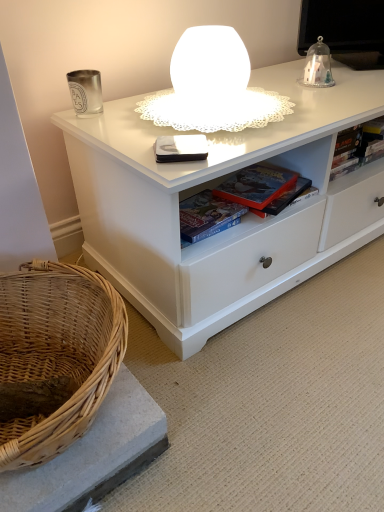
Measure the distance between hardcover book at upper right, acting as the first book starting from the right, and camera.

They are 3.57 feet apart.

I want to click on hardcover book at upper right, the first book positioned from the back, so click(x=358, y=147).

Describe the element at coordinates (212, 87) in the screenshot. Image resolution: width=384 pixels, height=512 pixels. I see `white frosted glass table lamp at upper center` at that location.

I want to click on white frosted glass table lamp at upper center, so click(x=212, y=87).

The image size is (384, 512). Describe the element at coordinates (226, 211) in the screenshot. I see `matte plastic book at center, acting as the 3th book starting from the left` at that location.

What is the approximate height of matte plastic book at center, which is the third book from front to back?

The height of matte plastic book at center, which is the third book from front to back, is 1.68 inches.

Measure the distance between point (203, 194) and camera.

The depth of point (203, 194) is 3.40 feet.

Locate an element on the screen. The height and width of the screenshot is (512, 384). hardcover book at upper right, which is the fourth book from left to right is located at coordinates (358, 147).

Which point is more forward, (199, 145) or (224, 225)?

Point (199, 145)

From a real-world perspective, which object rests below the other?

matte board game at center, acting as the 2th book starting from the left, from a real-world perspective.

Does glossy black book at center, the 4th book viewed from the right, appear on the left side of matte board game at center, arranged as the 2th book when viewed from the front?

Indeed, glossy black book at center, the 4th book viewed from the right, is positioned on the left side of matte board game at center, arranged as the 2th book when viewed from the front.

Does white frosted glass table lamp at upper center touch hardcover book at upper right, acting as the first book starting from the right?

No, white frosted glass table lamp at upper center is not next to hardcover book at upper right, acting as the first book starting from the right.

Can you confirm if white frosted glass table lamp at upper center is bigger than hardcover book at upper right, which is the fourth book from left to right?

Correct, white frosted glass table lamp at upper center is larger in size than hardcover book at upper right, which is the fourth book from left to right.

From the image's perspective, between white frosted glass table lamp at upper center and hardcover book at upper right, acting as the first book starting from the right, who is located below?

hardcover book at upper right, acting as the first book starting from the right.

In the scene shown: Can you tell me how much white frosted glass table lamp at upper center and hardcover book at upper right, acting as the first book starting from the right, differ in facing direction?

There is a 4.54-degree angle between the facing directions of white frosted glass table lamp at upper center and hardcover book at upper right, acting as the first book starting from the right.

Is the position of glossy black book at center, which is the first book in front-to-back order, less distant than that of white frosted glass table lamp at upper center?

No, it is behind white frosted glass table lamp at upper center.

Is point (191, 146) closer to viewer compared to point (196, 104)?

Yes, point (191, 146) is closer to viewer.

Could you tell me if glossy black book at center, which is the first book in front-to-back order, is turned towards white frosted glass table lamp at upper center?

No, glossy black book at center, which is the first book in front-to-back order, is not turned towards white frosted glass table lamp at upper center.

From the image's perspective, is glossy black book at center, the 1th book from the left, beneath white frosted glass table lamp at upper center?

Correct, glossy black book at center, the 1th book from the left, appears lower than white frosted glass table lamp at upper center in the image.

Consider the image. From the image's perspective, is white frosted glass table lamp at upper center above or below matte board game at center, which ranks as the 3th book in back-to-front order?

Clearly, from the image's perspective, white frosted glass table lamp at upper center is above matte board game at center, which ranks as the 3th book in back-to-front order.

Between white frosted glass table lamp at upper center and matte board game at center, which is counted as the third book, starting from the right, which one has more height?

white frosted glass table lamp at upper center is taller.

From a real-world perspective, is white frosted glass table lamp at upper center above or below matte board game at center, which ranks as the 3th book in back-to-front order?

Clearly, from a real-world perspective, white frosted glass table lamp at upper center is above matte board game at center, which ranks as the 3th book in back-to-front order.

Is hardcover book at upper right, acting as the first book starting from the right, positioned far away from matte plastic book at center, which is the third book from front to back?

hardcover book at upper right, acting as the first book starting from the right, is near matte plastic book at center, which is the third book from front to back, not far away.

Who is more distant, hardcover book at upper right, which is the fourth book from left to right, or matte plastic book at center, which is the third book from front to back?

hardcover book at upper right, which is the fourth book from left to right, is further from the camera.

From the image's perspective, does hardcover book at upper right, the first book positioned from the back, appear higher than matte plastic book at center, acting as the 3th book starting from the left?

Yes.

Looking at this image, which object is positioned more to the right, hardcover book at upper right, the first book positioned from the back, or matte plastic book at center, marked as the second book in a right-to-left arrangement?

hardcover book at upper right, the first book positioned from the back, is more to the right.

How different are the orientations of glossy black book at center, the 1th book from the left, and hardcover book at upper right, acting as the fourth book starting from the front, in degrees?

glossy black book at center, the 1th book from the left, and hardcover book at upper right, acting as the fourth book starting from the front, are facing 34.4 degrees away from each other.

Would you consider glossy black book at center, the 4th book viewed from the right, to be distant from hardcover book at upper right, acting as the first book starting from the right?

Actually, glossy black book at center, the 4th book viewed from the right, and hardcover book at upper right, acting as the first book starting from the right, are a little close together.

Based on the photo, between glossy black book at center, which is the first book in front-to-back order, and hardcover book at upper right, acting as the fourth book starting from the front, which one appears on the right side from the viewer's perspective?

hardcover book at upper right, acting as the fourth book starting from the front.

From the image's perspective, between glossy black book at center, the 4th book viewed from the right, and hardcover book at upper right, the first book positioned from the back, which one is located above?

hardcover book at upper right, the first book positioned from the back, appears higher in the image.

Considering the relative positions of matte plastic book at center, acting as the 3th book starting from the left, and white frosted glass table lamp at upper center in the image provided, is matte plastic book at center, acting as the 3th book starting from the left, to the left or to the right of white frosted glass table lamp at upper center?

matte plastic book at center, acting as the 3th book starting from the left, is positioned on white frosted glass table lamp at upper center's right side.

From the image's perspective, is matte plastic book at center, which is the third book from front to back, located beneath white frosted glass table lamp at upper center?

Indeed, from the image's perspective, matte plastic book at center, which is the third book from front to back, is shown beneath white frosted glass table lamp at upper center.

Is matte plastic book at center, which is the third book from front to back, facing towards white frosted glass table lamp at upper center?

No, matte plastic book at center, which is the third book from front to back, is not oriented towards white frosted glass table lamp at upper center.

Is there a large distance between matte plastic book at center, which is the third book from front to back, and white frosted glass table lamp at upper center?

No.

Locate an element on the screen. The height and width of the screenshot is (512, 384). book on the left of matte board game at center, acting as the 2th book starting from the left is located at coordinates (180, 148).

There is a hardcover book at upper right, the first book positioned from the back. At what (x,y) coordinates should I click in order to perform the action: click on table lamp above it (from a real-world perspective). Please return your answer as a coordinate pair (x, y). Looking at the image, I should click on (212, 87).

When comparing their distances from white frosted glass table lamp at upper center, does glossy black book at center, the 4th book viewed from the right, or matte plastic book at center, the 2th book positioned from the back, seem closer?

glossy black book at center, the 4th book viewed from the right.

Looking at the image, which one is located further to matte board game at center, arranged as the 2th book when viewed from the front, white frosted glass table lamp at upper center or hardcover book at upper right, acting as the first book starting from the right?

hardcover book at upper right, acting as the first book starting from the right, lies further to matte board game at center, arranged as the 2th book when viewed from the front, than the other object.

Looking at the image, which one is located further to matte board game at center, which is counted as the third book, starting from the right, glossy black book at center, the 1th book from the left, or matte plastic book at center, marked as the second book in a right-to-left arrangement?

glossy black book at center, the 1th book from the left, is further to matte board game at center, which is counted as the third book, starting from the right.

When comparing their distances from white frosted glass table lamp at upper center, does hardcover book at upper right, which is the fourth book from left to right, or matte board game at center, which is counted as the third book, starting from the right, seem further?

hardcover book at upper right, which is the fourth book from left to right.

Estimate the real-world distances between objects in this image. Which object is further from white frosted glass table lamp at upper center, matte board game at center, acting as the 2th book starting from the left, or hardcover book at upper right, acting as the fourth book starting from the front?

Among the two, hardcover book at upper right, acting as the fourth book starting from the front, is located further to white frosted glass table lamp at upper center.

Estimate the real-world distances between objects in this image. Which object is further from white frosted glass table lamp at upper center, glossy black book at center, the 4th book viewed from the right, or matte board game at center, which is counted as the third book, starting from the right?

Based on the image, matte board game at center, which is counted as the third book, starting from the right, appears to be further to white frosted glass table lamp at upper center.

Considering their positions, is matte plastic book at center, the 2th book positioned from the back, positioned further to glossy black book at center, the fourth book viewed from the back, than hardcover book at upper right, acting as the first book starting from the right?

hardcover book at upper right, acting as the first book starting from the right, is further to glossy black book at center, the fourth book viewed from the back.

Looking at the image, which one is located further to matte plastic book at center, which is the third book from front to back, white frosted glass table lamp at upper center or matte board game at center, arranged as the 2th book when viewed from the front?

white frosted glass table lamp at upper center is further to matte plastic book at center, which is the third book from front to back.

Where is `table lamp between glossy black book at center, the 4th book viewed from the right, and hardcover book at upper right, which is the fourth book from left to right`? The height and width of the screenshot is (512, 384). table lamp between glossy black book at center, the 4th book viewed from the right, and hardcover book at upper right, which is the fourth book from left to right is located at coordinates (212, 87).

I want to click on book located between matte board game at center, which ranks as the 3th book in back-to-front order, and hardcover book at upper right, acting as the first book starting from the right, in the left-right direction, so click(x=226, y=211).

Locate an element on the screen. The image size is (384, 512). book between glossy black book at center, the 4th book viewed from the right, and matte plastic book at center, which is the third book from front to back, from left to right is located at coordinates (206, 216).

At what (x,y) coordinates should I click in order to perform the action: click on table lamp located between matte board game at center, arranged as the 2th book when viewed from the front, and hardcover book at upper right, acting as the fourth book starting from the front, in the left-right direction. Please return your answer as a coordinate pair (x, y). Looking at the image, I should click on (212, 87).